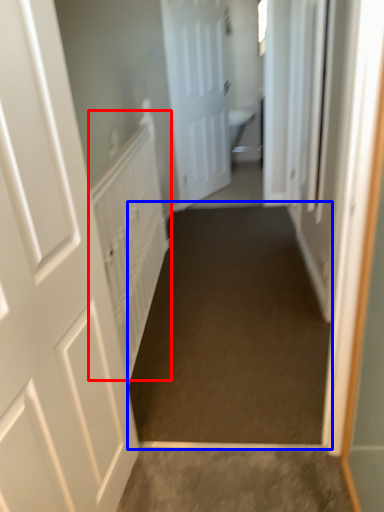
Question: Which object appears closest to the camera in this image, radiator (highlighted by a red box) or path (highlighted by a blue box)?

Choices:
 (A) radiator
 (B) path

Answer: (B)